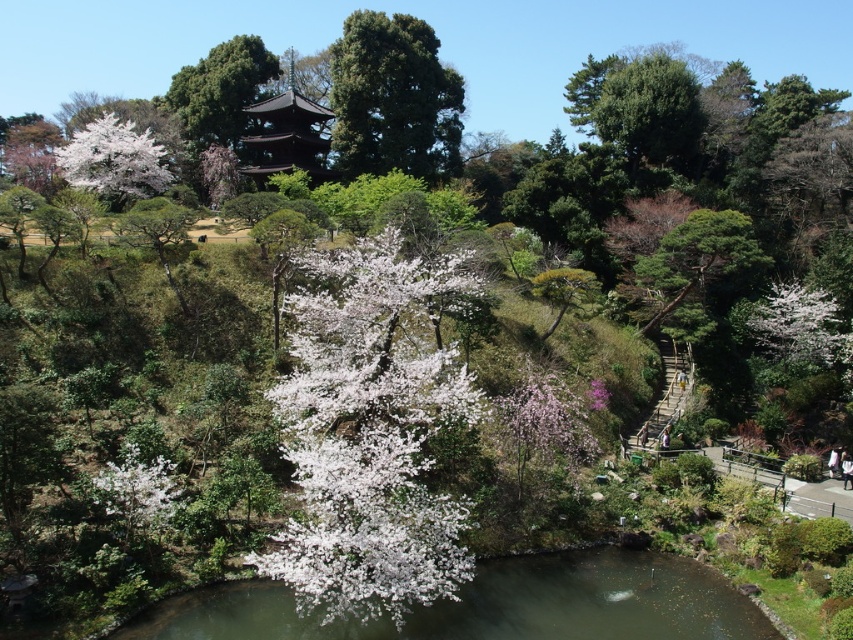
Question: Which object is farther from the camera taking this photo?

Choices:
 (A) purple-pink silky flower at center
 (B) green textured tree at upper center
 (C) white fluffy blossoms at upper left

Answer: (B)

Question: Can you confirm if green textured tree at upper center is wider than white fluffy blossoms at upper left?

Choices:
 (A) no
 (B) yes

Answer: (A)

Question: Considering the real-world distances, which object is farthest from the white matte flower at center?

Choices:
 (A) pink silky blossoms at center
 (B) white fluffy blossoms at upper left
 (C) green textured tree at upper center
 (D) white fluffy blossoms at lower left

Answer: (C)

Question: Does white matte flower at upper right have a greater width compared to white fluffy blossoms at lower left?

Choices:
 (A) no
 (B) yes

Answer: (B)

Question: Estimate the real-world distances between objects in this image. Which object is closer to the white fluffy blossoms at lower left?

Choices:
 (A) white matte flower at center
 (B) white fluffy blossoms at upper left

Answer: (A)

Question: Is white matte flower at upper right below purple-pink silky flower at center?

Choices:
 (A) yes
 (B) no

Answer: (B)